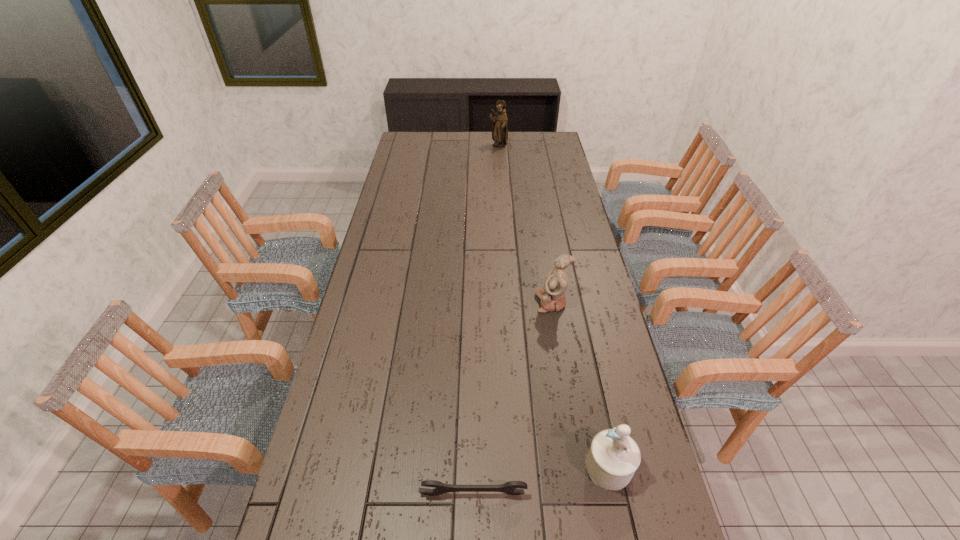
Identify which figurine is the second closest to the second nearest figurine. Please provide its 2D coordinates. Your answer should be formatted as a tuple, i.e. [(x, y)], where the tuple contains the x and y coordinates of a point satisfying the conditions above.

[(499, 123)]

Identify which figurine is the third closest to the nearest object. Please provide its 2D coordinates. Your answer should be formatted as a tuple, i.e. [(x, y)], where the tuple contains the x and y coordinates of a point satisfying the conditions above.

[(499, 123)]

Identify the location of vacant region that satisfies the following two spatial constraints: 1. at the beak of the third farthest object; 2. on the open ends of the nearest object. (615, 494).

You are a GUI agent. You are given a task and a screenshot of the screen. Output one action in this format:
    pyautogui.click(x=<x>, y=<y>)
    Task: Click on the vacant position in the image that satisfies the following two spatial constraints: 1. on the front-facing side of the second farthest object; 2. on the open ends of the shortest object
    This screenshot has width=960, height=540.
    Given the screenshot: What is the action you would take?
    pyautogui.click(x=584, y=494)

Where is `free space that satisfies the following two spatial constraints: 1. at the beak of the third farthest object; 2. on the open ends of the shortest object`? This screenshot has height=540, width=960. free space that satisfies the following two spatial constraints: 1. at the beak of the third farthest object; 2. on the open ends of the shortest object is located at coordinates (615, 494).

The height and width of the screenshot is (540, 960). In order to click on free space that satisfies the following two spatial constraints: 1. at the beak of the nearest figurine; 2. on the open ends of the shortest object in this screenshot , I will do `click(615, 494)`.